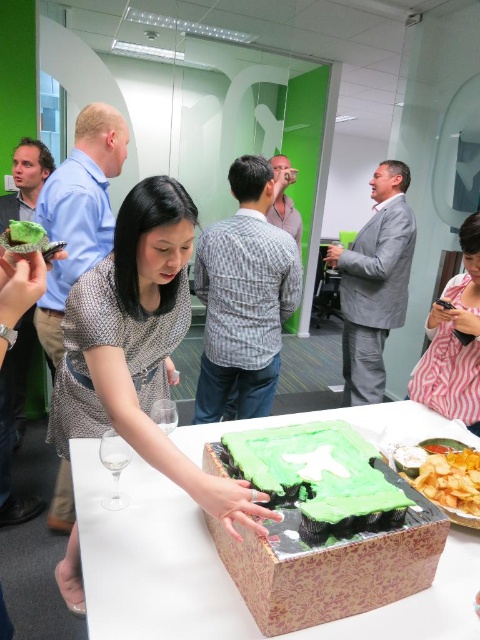
You are standing in front of a table at an office event with a matte green cake at center. If you want to grab the cake without moving your feet, can you reach it?

The matte green cake at center is 36.25 inches from viewer, so if your arm can reach 36.25 inches or more, you can grab it without moving your feet.

You are at a party and want to grab a cupcake from the green frosted cake at center. However, you are standing near the pink striped shirt at lower right. Which direction should you move to reach the cake?

The green frosted cake at center is to the left of the pink striped shirt at lower right, so you should move to your left to reach the cake.